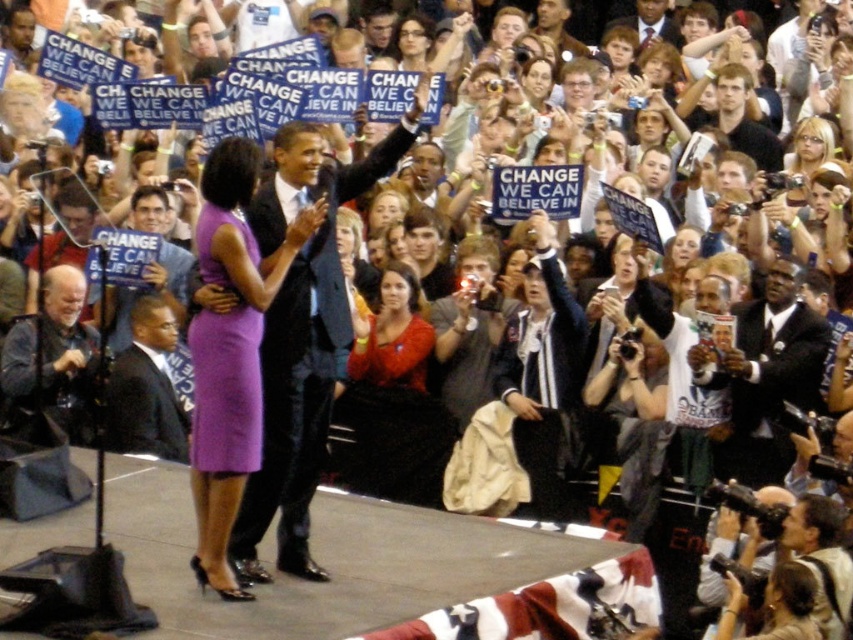
Is matte black suit at center taller than purple satin dress at center?

Yes.

Does matte black suit at center appear on the left side of purple satin dress at center?

In fact, matte black suit at center is to the right of purple satin dress at center.

The width and height of the screenshot is (853, 640). Describe the element at coordinates (303, 337) in the screenshot. I see `matte black suit at center` at that location.

Find the location of a particular element. matte black suit at center is located at coordinates (303, 337).

Is purple satin dress at center wider than matte red dress at center?

Incorrect, purple satin dress at center's width does not surpass matte red dress at center's.

Who is lower down, purple satin dress at center or matte red dress at center?

matte red dress at center is below.

Locate an element on the screen. Image resolution: width=853 pixels, height=640 pixels. purple satin dress at center is located at coordinates (231, 349).

In the scene shown: Who is lower down, matte black suit at center or matte red dress at center?

matte red dress at center is below.

Between matte black suit at center and matte red dress at center, which one appears on the left side from the viewer's perspective?

matte black suit at center is more to the left.

Between point (303, 154) and point (439, 486), which one is positioned behind?

Point (439, 486)

Find the location of a particular element. matte black suit at center is located at coordinates (303, 337).